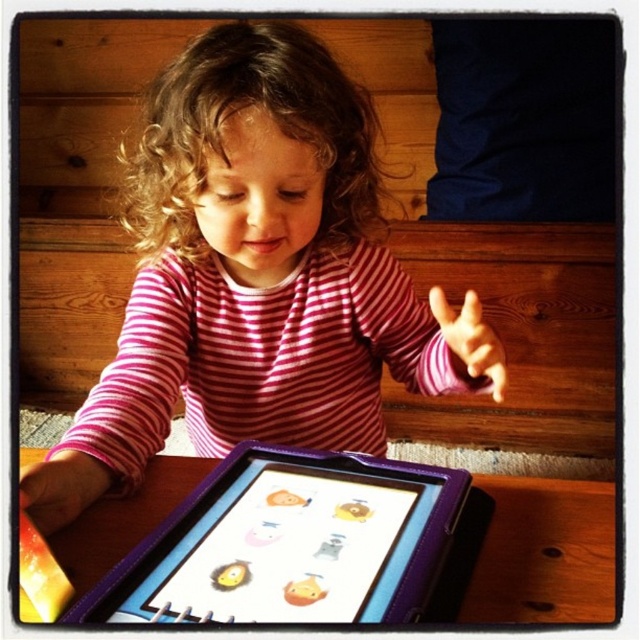
Question: Does pink fabric hand at center appear on the right side of matte yellow crayon at lower left?

Choices:
 (A) no
 (B) yes

Answer: (B)

Question: Can you confirm if pink striped shirt at center is bigger than matte pink hand at lower left?

Choices:
 (A) yes
 (B) no

Answer: (A)

Question: Observing the image, what is the correct spatial positioning of matte pink hand at lower left in reference to pink fabric hand at center?

Choices:
 (A) right
 (B) left

Answer: (B)

Question: Which object appears farthest from the camera in this image?

Choices:
 (A) pink fabric hand at center
 (B) pink striped shirt at center
 (C) matte pink hand at lower left
 (D) purple leather tablet at lower center

Answer: (B)

Question: Among these objects, which one is nearest to the camera?

Choices:
 (A) matte pink hand at lower left
 (B) matte yellow crayon at lower left

Answer: (B)

Question: Which of the following is the closest to the observer?

Choices:
 (A) (44, 598)
 (B) (348, 593)
 (C) (93, 488)
 (D) (346, 243)

Answer: (B)